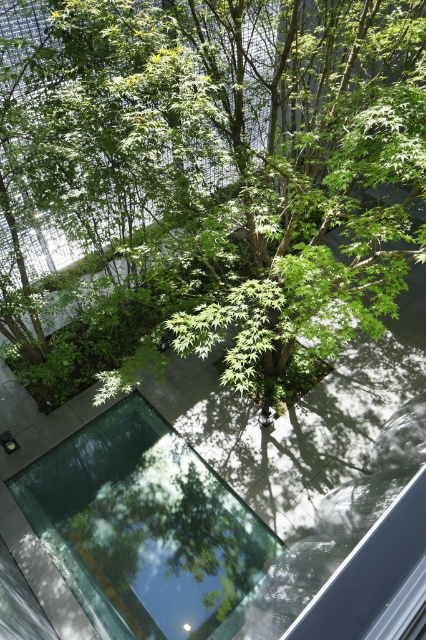
Question: Which point is closer to the camera taking this photo?

Choices:
 (A) (155, 56)
 (B) (195, 577)

Answer: (A)

Question: Observing the image, what is the correct spatial positioning of green leafy tree at center in reference to transparent glass pool at center?

Choices:
 (A) below
 (B) above

Answer: (B)

Question: Where is green leafy tree at center located in relation to transparent glass pool at center in the image?

Choices:
 (A) right
 (B) left

Answer: (A)

Question: Which object appears closest to the camera in this image?

Choices:
 (A) transparent glass pool at center
 (B) green leafy tree at center

Answer: (B)

Question: Can you confirm if green leafy tree at center is smaller than transparent glass pool at center?

Choices:
 (A) no
 (B) yes

Answer: (B)